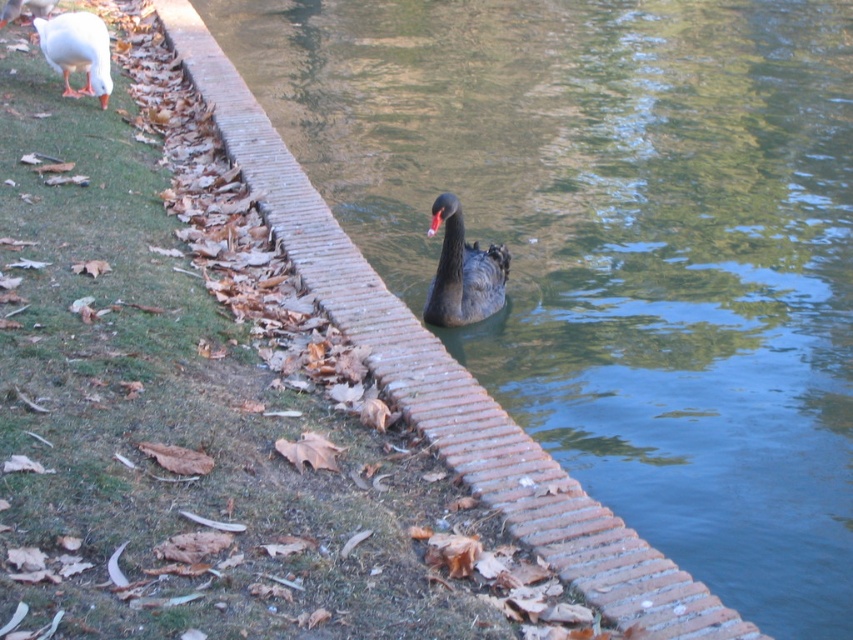
Can you confirm if brick at center is smaller than shiny black swan at center?

Indeed, brick at center has a smaller size compared to shiny black swan at center.

Between point (498, 476) and point (444, 208), which one is positioned behind?

Point (444, 208)

Does point (663, 572) come behind point (480, 298)?

No, (663, 572) is closer to viewer.

At what (x,y) coordinates should I click in order to perform the action: click on brick at center. Please return your answer as a coordinate pair (x, y). The width and height of the screenshot is (853, 640). Looking at the image, I should click on tap(445, 380).

Is brick at center to the right of white matte duck at upper left from the viewer's perspective?

Indeed, brick at center is positioned on the right side of white matte duck at upper left.

Is brick at center positioned in front of white matte duck at upper left?

Yes, it is.

Does point (310, 200) lie behind point (85, 51)?

No, it is not.

Find the location of a particular element. The width and height of the screenshot is (853, 640). brick at center is located at coordinates (445, 380).

Is shiny black swan at center shorter than white matte duck at upper left?

Incorrect, shiny black swan at center's height does not fall short of white matte duck at upper left's.

Between shiny black swan at center and white matte duck at upper left, which one appears on the left side from the viewer's perspective?

Positioned to the left is white matte duck at upper left.

Describe the element at coordinates (463, 272) in the screenshot. I see `shiny black swan at center` at that location.

Locate an element on the screen. This screenshot has width=853, height=640. shiny black swan at center is located at coordinates (463, 272).